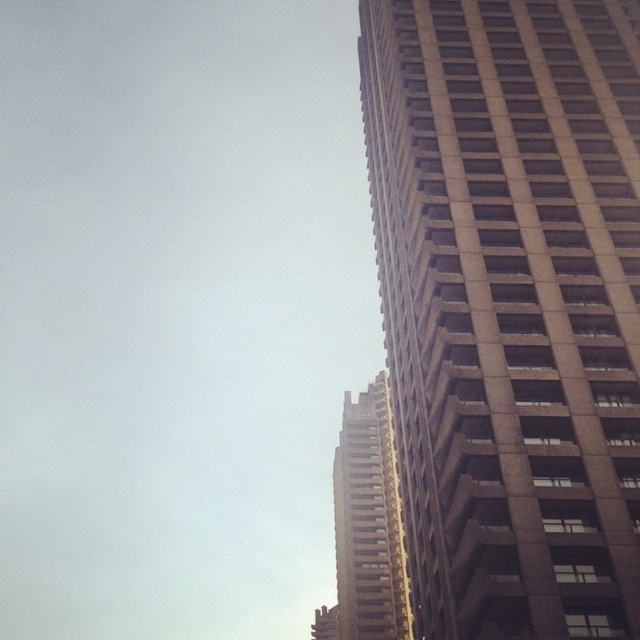
Which is more to the left, brown concrete building at right or brown concrete building at center?

Positioned to the left is brown concrete building at center.

Is brown concrete building at right below brown concrete building at center?

Incorrect, brown concrete building at right is not positioned below brown concrete building at center.

Does point (486, 476) come in front of point (381, 486)?

Yes, it is.

Locate an element on the screen. brown concrete building at right is located at coordinates (509, 305).